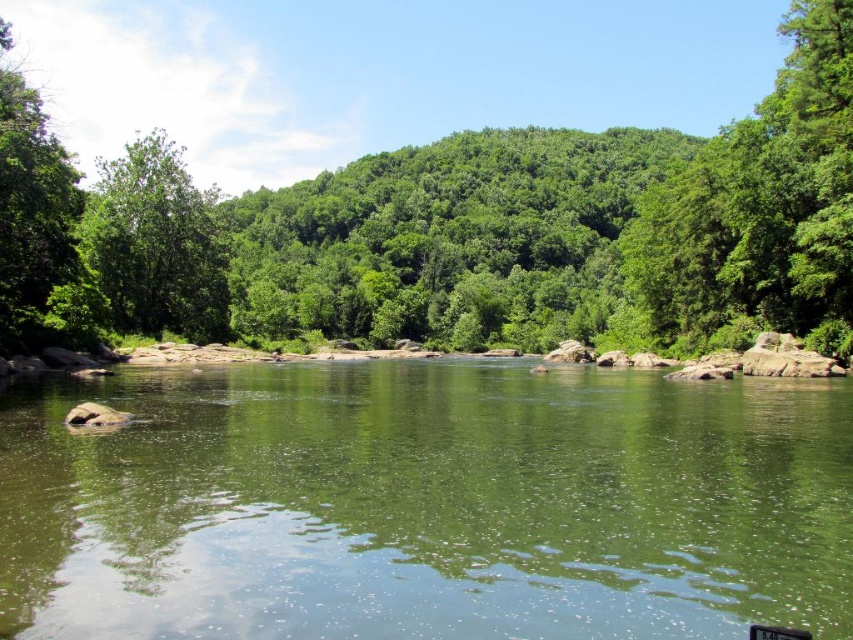
You are standing on a path that runs parallel to the river. You see the green smooth water at center and the green leafy tree at center. Which object is closer to your right side?

The green smooth water at center is to the right of green leafy tree at center, so it is closer to your right side.

You are a photographer planning to capture the green smooth water at center and the green leafy tree at center in a single frame. Given that your camera has a limited field of view, which object should you prioritize framing first to ensure both are visible?

The green smooth water at center is smaller than the green leafy tree at center, so you should prioritize framing the smaller green smooth water at center first to ensure both fit within the camera frame.